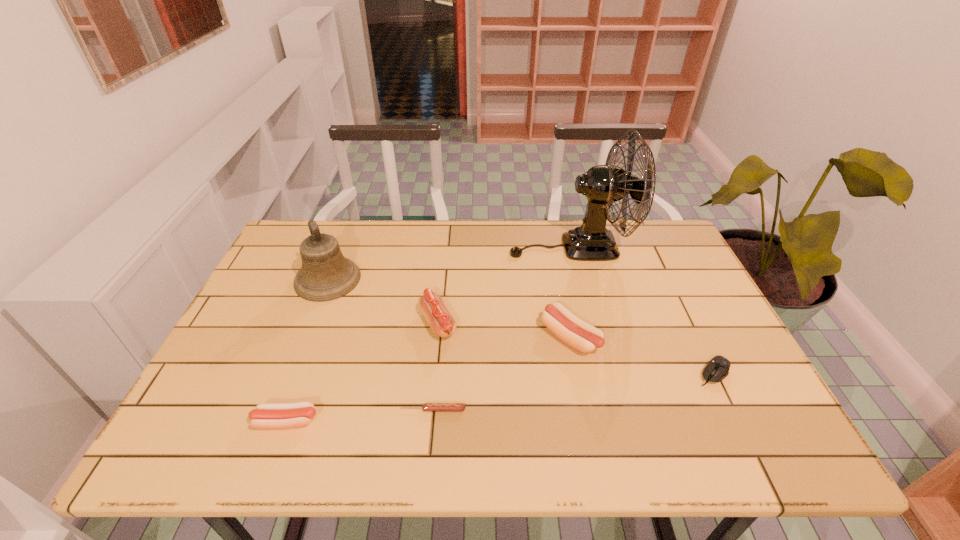
You are a GUI agent. You are given a task and a screenshot of the screen. Output one action in this format:
    pyautogui.click(x=<x>, y=<y>)
    Task: Click on the sausage at the left edge
    Image resolution: width=960 pixels, height=540 pixels.
    Given the screenshot: What is the action you would take?
    pyautogui.click(x=266, y=415)

In order to click on fan at the right edge in this screenshot , I will do `click(603, 185)`.

This screenshot has height=540, width=960. I want to click on computer mouse at the right edge, so click(717, 369).

Locate an element on the screen. object located in the far left corner section of the desktop is located at coordinates (325, 275).

The height and width of the screenshot is (540, 960). Identify the location of object that is at the near left corner. (266, 415).

Where is `object that is positioned at the far right corner`? This screenshot has height=540, width=960. object that is positioned at the far right corner is located at coordinates (603, 185).

This screenshot has width=960, height=540. In the image, there is a desktop. Find the location of `vacant space at the far edge`. vacant space at the far edge is located at coordinates (499, 232).

The width and height of the screenshot is (960, 540). What are the coordinates of `blank area at the near edge` in the screenshot? It's located at (654, 429).

In the image, there is a desktop. Identify the location of vacant space at the left edge. (299, 319).

Locate an element on the screen. This screenshot has width=960, height=540. vacant space at the far left corner of the desktop is located at coordinates (334, 225).